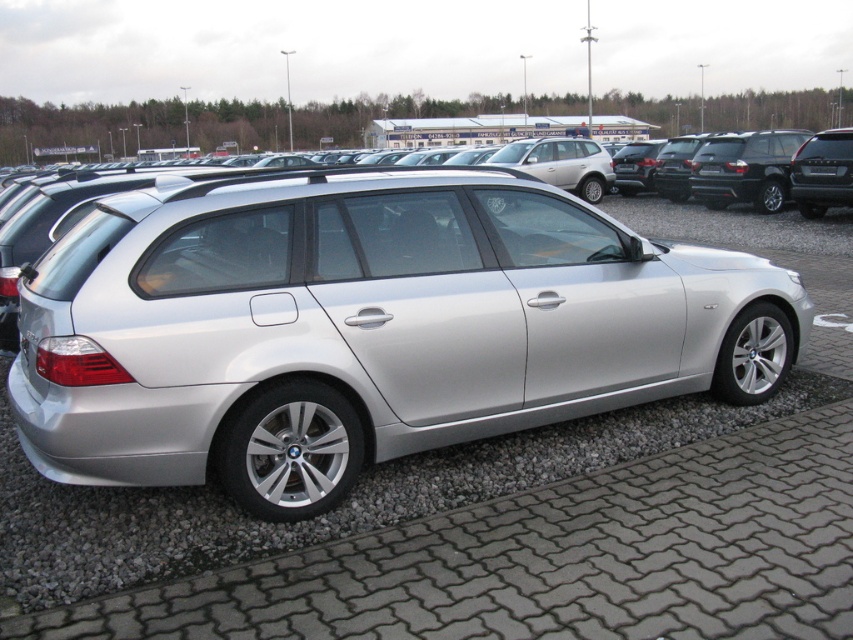
You are standing in a car dealership lot and see a silver BMW station wagon at center. There is a point marked at coordinates (364, 326). Can you tell me what object this point is located on?

The point at coordinates (364, 326) is located on the satin silver car at center.

You are a photographer trying to capture the satin silver car at center without the black plastic license plate at center appearing in the shot. Is this possible given their current positions?

The satin silver car at center is in front of the black plastic license plate at center, so it would block the license plate from view. Therefore, you can take a photo of the satin silver car at center without the black plastic license plate at center showing in the image.

You are a customer looking to park your car in the dealership lot. You see the satin silver car at center and the satin black suv at upper right. Which direction should you drive to get between them?

To get between the satin silver car at center and the satin black suv at upper right, you should drive towards the left side of the satin black suv at upper right since the satin silver car at center is positioned to its left.